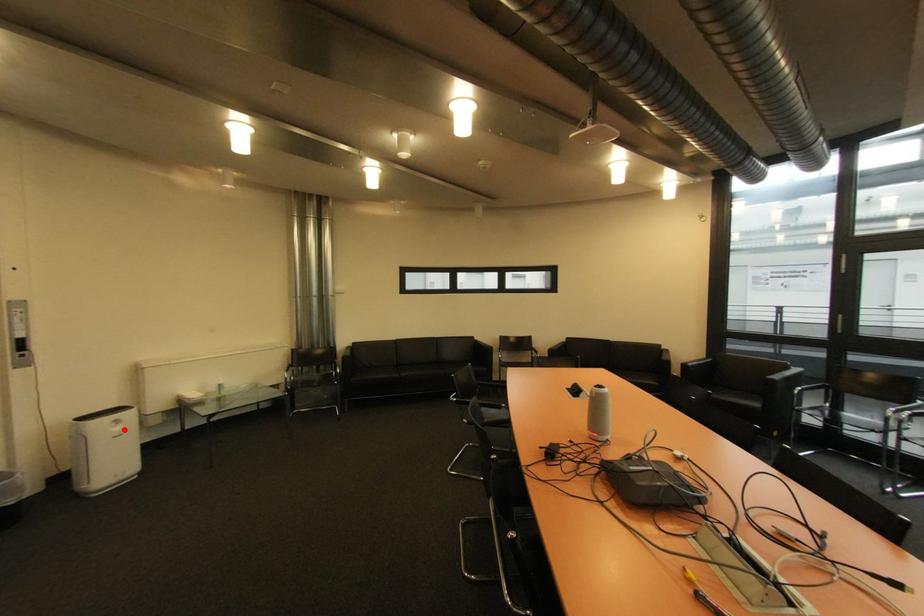
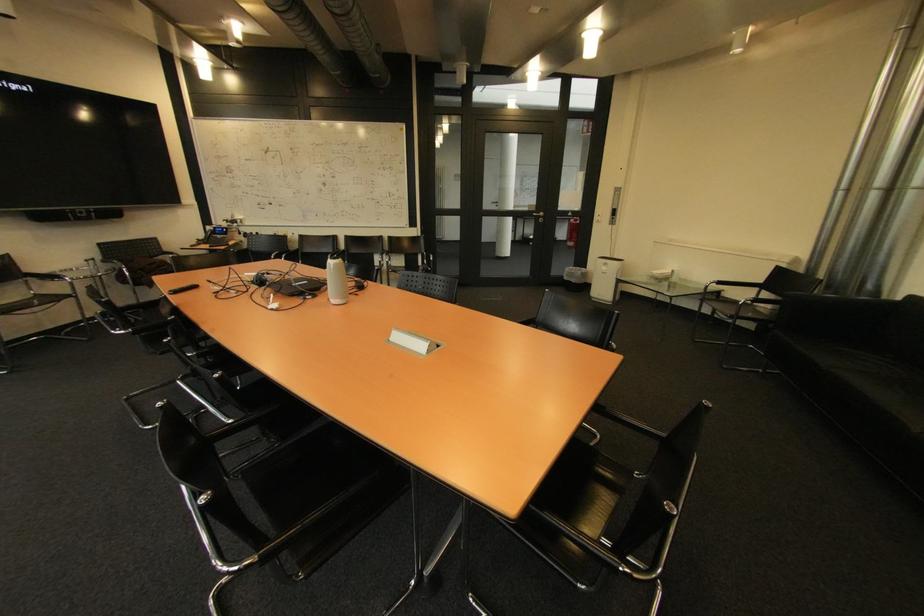
Find the pixel in the second image that matches the highlighted location in the first image.

(613, 270)